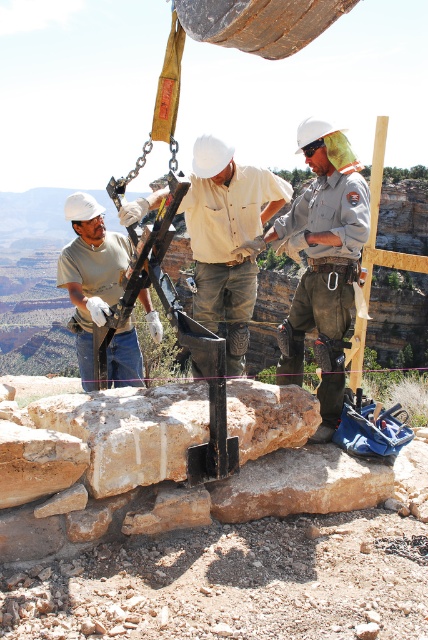
Who is taller, khaki uniform at center or matte black tool at left?

matte black tool at left

Who is lower down, khaki uniform at center or matte black tool at left?

khaki uniform at center is below.

Where is `khaki uniform at center`? This screenshot has width=428, height=640. khaki uniform at center is located at coordinates (323, 262).